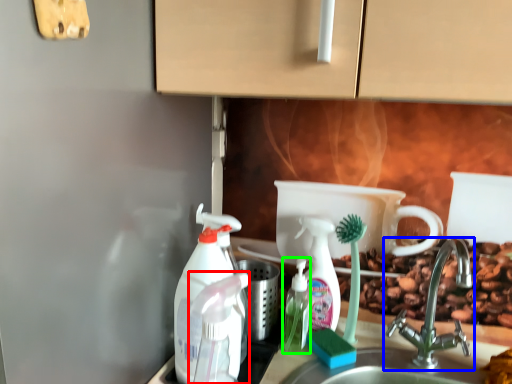
Question: Which object is positioned closest to cleaning product (highlighted by a red box)? Select from tap (highlighted by a blue box) and bottle (highlighted by a green box).

Choices:
 (A) tap
 (B) bottle

Answer: (B)